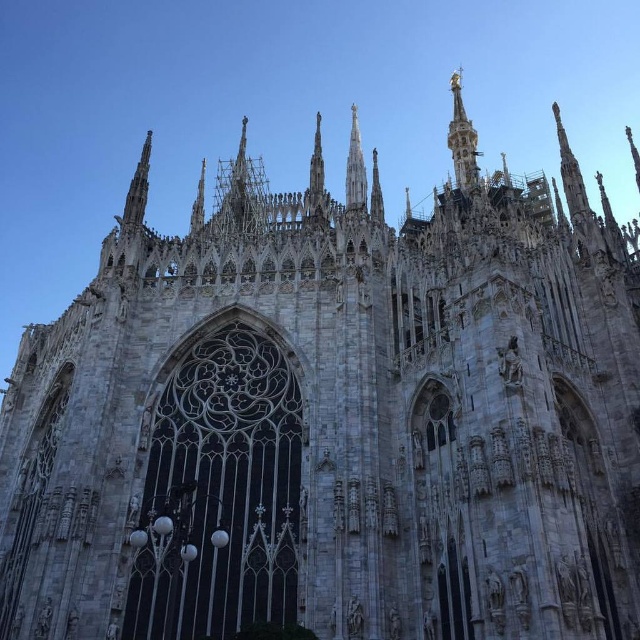
You are standing in front of the Milan Cathedral and want to take a photo that includes both the point at coordinates point [465,147] and point [349,180]. Based on their positions, which point is closer to you?

Point [349,180] is closer to you because it is in front of point [465,147].

You are an architect visiting Milan Cathedral and want to compare the two spires on the facade. Which spire, the gold polished spire at upper center or the gray stone spire at center, is taller?

The gold polished spire at upper center is taller than the gray stone spire at center.

You are an architect examining the Milan Cathedral facade. You notice the gold polished spire at upper center and the gray stone spire at center. Which spire is closer to the observer?

The gray stone spire at center is behind the gold polished spire at upper center, so the gold polished spire at upper center is closer to the observer.